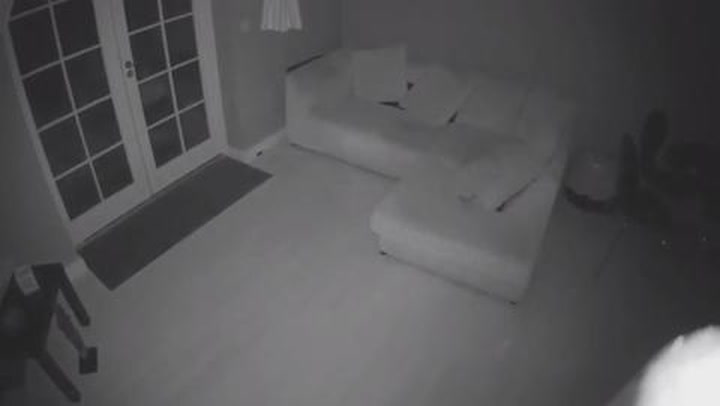
The image size is (720, 406). I want to click on door frames middle of doors, so click(117, 88), click(130, 90).